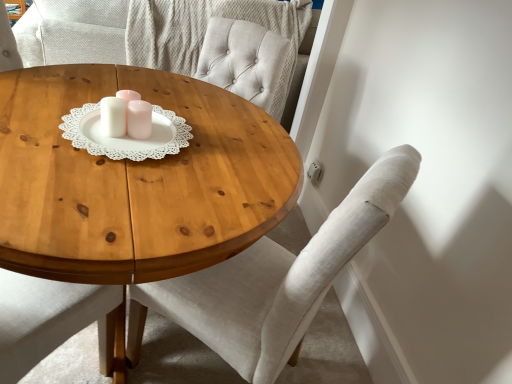
The width and height of the screenshot is (512, 384). Identify the location of free location above wooden coffee table at center (from a real-world perspective). (158, 135).